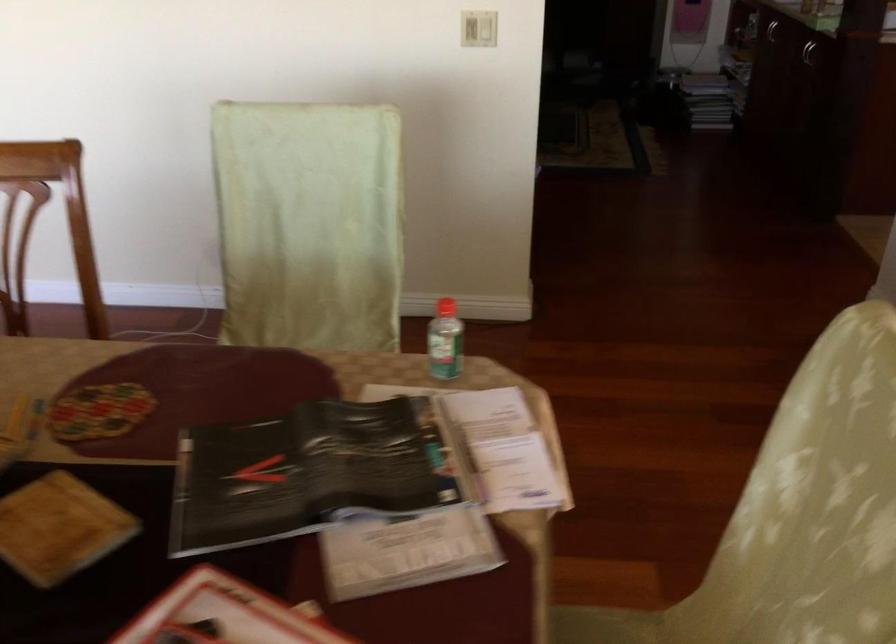
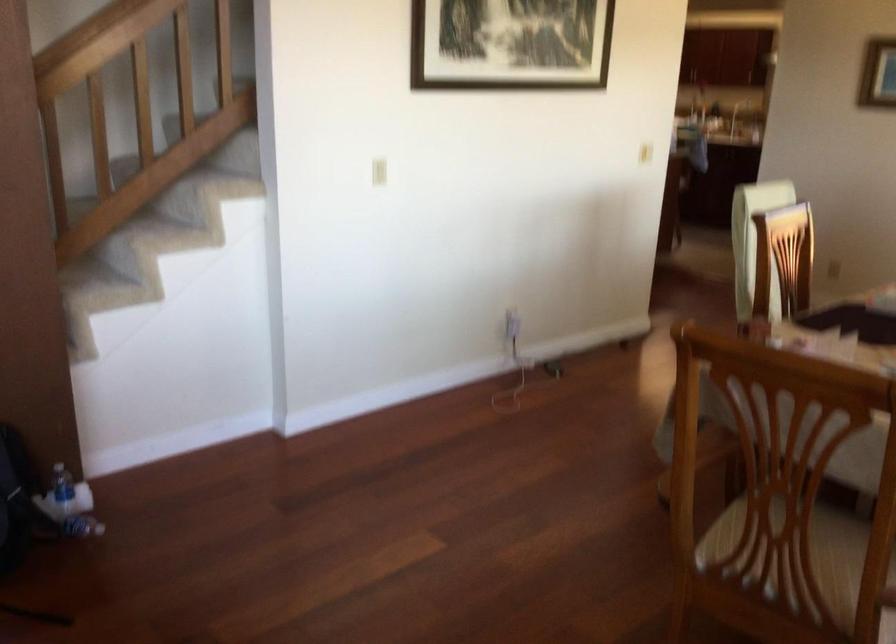
Find the pixel in the second image that matches (x=207, y=234) in the first image.

(512, 323)